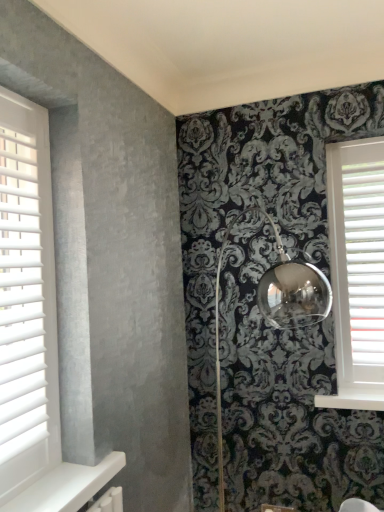
Question: Is white painted wood at lower right oriented away from white plastic blinds at right?

Choices:
 (A) no
 (B) yes

Answer: (A)

Question: Are white painted wood at lower right and white plastic blinds at right far apart?

Choices:
 (A) yes
 (B) no

Answer: (B)

Question: Is white painted wood at lower right next to white plastic blinds at right?

Choices:
 (A) yes
 (B) no

Answer: (B)

Question: Can you confirm if white painted wood at lower right is positioned to the right of white plastic blinds at right?

Choices:
 (A) no
 (B) yes

Answer: (A)

Question: From a real-world perspective, is white painted wood at lower right physically below white plastic blinds at right?

Choices:
 (A) no
 (B) yes

Answer: (B)

Question: From the image's perspective, would you say white painted wood at lower right is positioned over white plastic blinds at right?

Choices:
 (A) no
 (B) yes

Answer: (A)

Question: From a real-world perspective, is white painted wood at lower right on top of white wood blinds at left?

Choices:
 (A) yes
 (B) no

Answer: (B)

Question: Is white painted wood at lower right oriented towards white wood blinds at left?

Choices:
 (A) yes
 (B) no

Answer: (B)

Question: Is white painted wood at lower right not within white wood blinds at left?

Choices:
 (A) no
 (B) yes

Answer: (B)

Question: Is white painted wood at lower right to the left of white wood blinds at left from the viewer's perspective?

Choices:
 (A) no
 (B) yes

Answer: (A)

Question: Is white painted wood at lower right touching white wood blinds at left?

Choices:
 (A) yes
 (B) no

Answer: (B)

Question: Is white painted wood at lower right far away from white wood blinds at left?

Choices:
 (A) no
 (B) yes

Answer: (B)

Question: From the image's perspective, is white wood blinds at left under white plastic blinds at right?

Choices:
 (A) no
 (B) yes

Answer: (B)